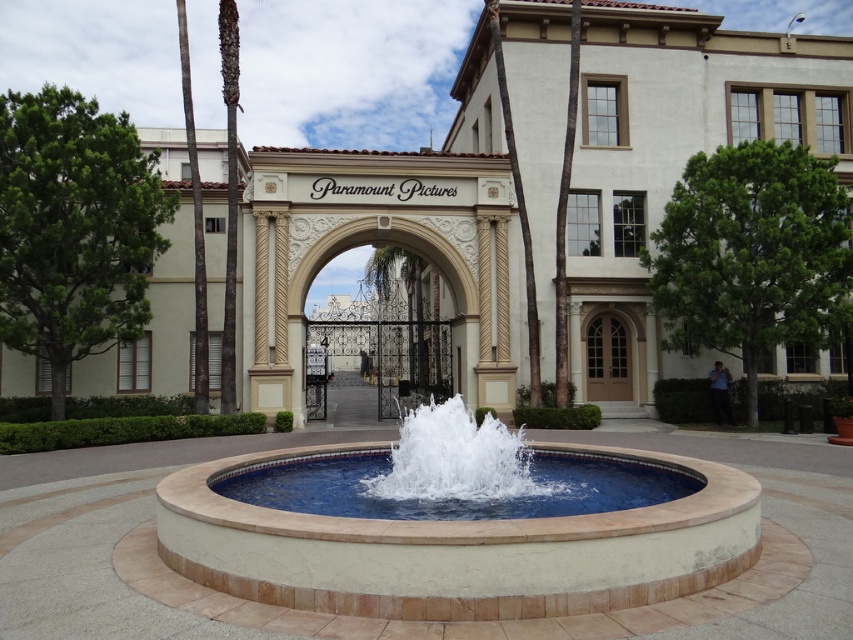
You are standing at the entrance of Paramount Pictures and want to take a photo of the white stone archway at center. However, you need to ensure that the green textured tree at left does not block the view. Given that your camera has a 50mm lens, which has a field of view of approximately 46 degrees, can you determine if the tree will be visible in the photo when you are positioned exactly at the entrance?

The green textured tree at left is 19.29 feet away from the white stone archway at center. To determine visibility, we need to calculate the angle between the tree and the archway from your position. However, without knowing the exact distance from you to the archway, we cannot accurately compute the angle. Therefore, it is uncertain if the tree will block the view.

You are standing at the entrance of Paramount Pictures and want to take a photo of the white stucco building at center. Where should you position yourself to capture the building in the frame?

To capture the white stucco building at center in the frame, position yourself at the entrance area facing the building, as it is centrally located at point coordinates approximately 0.223 on the x axis and 0.794 on the y axis.